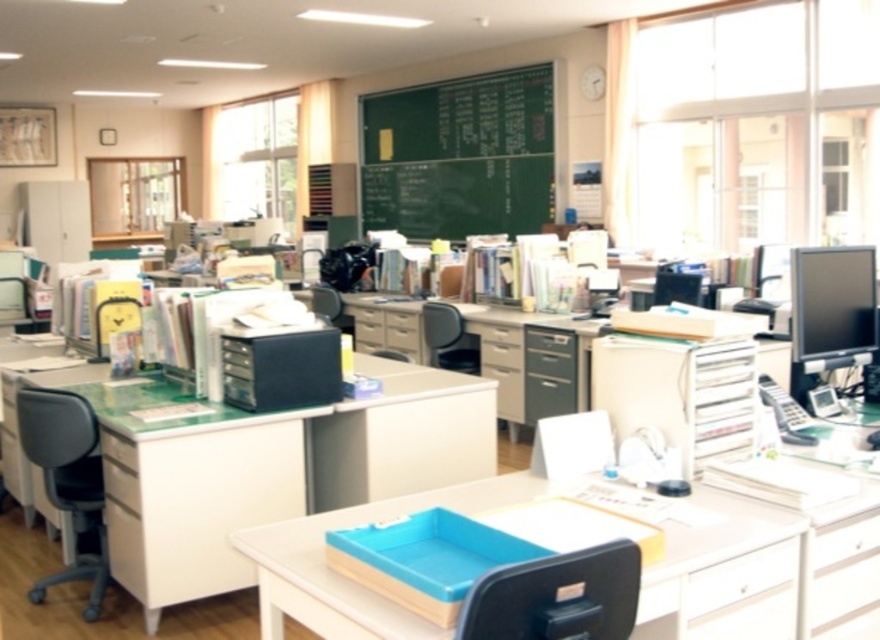
Does matte plastic table at center have a lesser height compared to black plastic swivel chair at center?

No.

Who is higher up, matte plastic table at center or black plastic swivel chair at center?

matte plastic table at center is above.

This screenshot has height=640, width=880. What are the coordinates of `matte plastic table at center` in the screenshot? It's located at (274, 467).

At what (x,y) coordinates should I click in order to perform the action: click on matte plastic table at center. Please return your answer as a coordinate pair (x, y). The width and height of the screenshot is (880, 640). Looking at the image, I should click on (274, 467).

Can you confirm if matte plastic table at center is smaller than white glossy drawer at center?

No, matte plastic table at center is not smaller than white glossy drawer at center.

Image resolution: width=880 pixels, height=640 pixels. Describe the element at coordinates (274, 467) in the screenshot. I see `matte plastic table at center` at that location.

The width and height of the screenshot is (880, 640). Find the location of `matte plastic table at center`. matte plastic table at center is located at coordinates (274, 467).

Which is more to the left, green chalkboard at center or white plastic drawer at lower left?

Positioned to the left is white plastic drawer at lower left.

Is green chalkboard at center to the right of white plastic drawer at lower left from the viewer's perspective?

Correct, you'll find green chalkboard at center to the right of white plastic drawer at lower left.

This screenshot has width=880, height=640. Describe the element at coordinates (460, 156) in the screenshot. I see `green chalkboard at center` at that location.

Where is `green chalkboard at center`? This screenshot has height=640, width=880. green chalkboard at center is located at coordinates (460, 156).